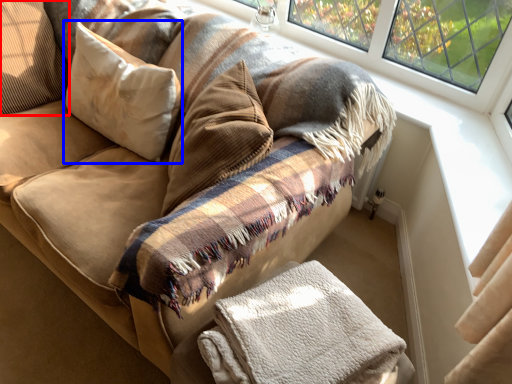
Question: Which object is further to the camera taking this photo, pillow (highlighted by a red box) or pillow (highlighted by a blue box)?

Choices:
 (A) pillow
 (B) pillow

Answer: (A)